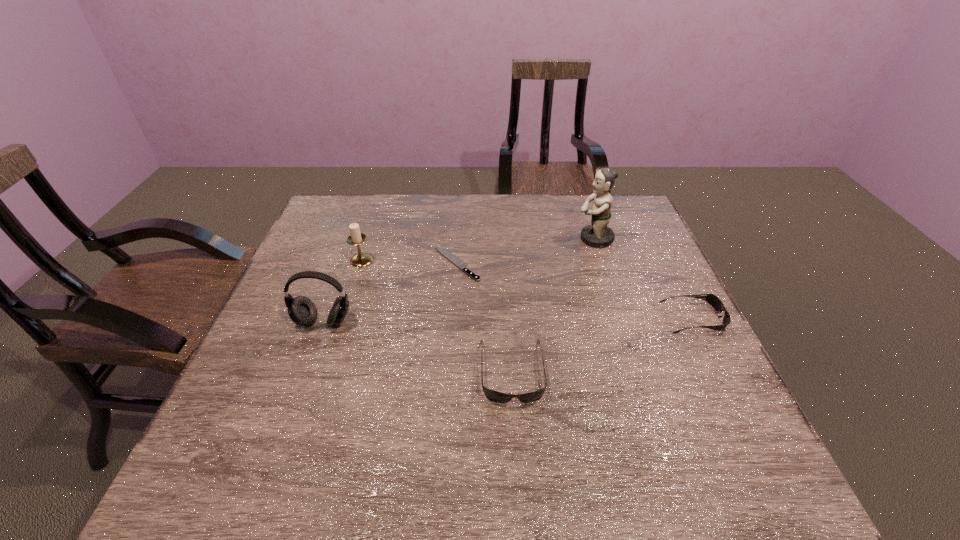
Find the location of a particular element. vacant space that satisfies the following two spatial constraints: 1. on the front side of the shortest object; 2. on the left side of the fourth shortest object is located at coordinates (360, 264).

The height and width of the screenshot is (540, 960). I want to click on free spot that satisfies the following two spatial constraints: 1. on the front-facing side of the rightmost object; 2. on the ear cups of the headset, so click(x=695, y=321).

I want to click on free spot that satisfies the following two spatial constraints: 1. on the front-facing side of the tallest object; 2. on the front side of the candle holder, so click(x=601, y=260).

Where is `free space that satisfies the following two spatial constraints: 1. on the front-facing side of the right sunglasses; 2. on the front-facing side of the nearer sunglasses`? The image size is (960, 540). free space that satisfies the following two spatial constraints: 1. on the front-facing side of the right sunglasses; 2. on the front-facing side of the nearer sunglasses is located at coordinates (720, 370).